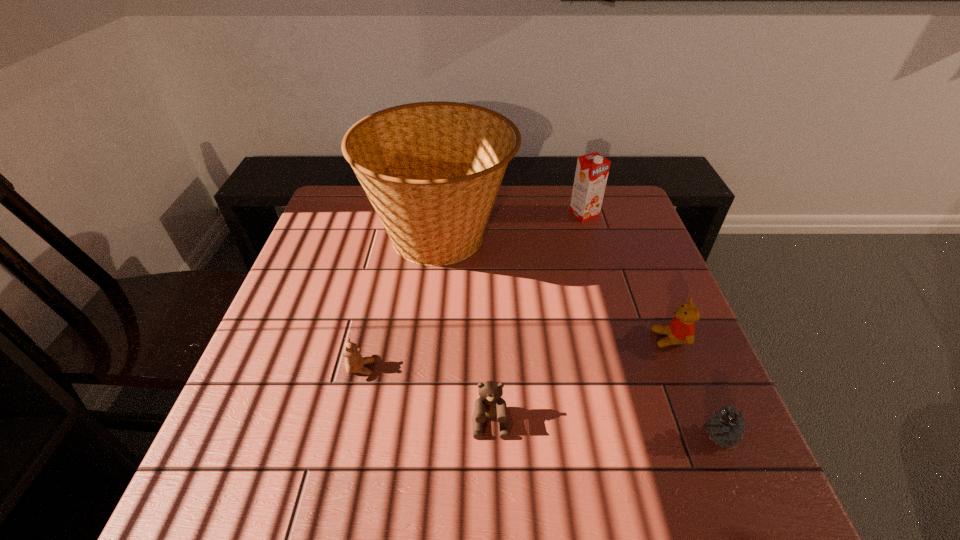
Where is `vacant area between the nearest teddy bear and the rightmost teddy bear`? The height and width of the screenshot is (540, 960). vacant area between the nearest teddy bear and the rightmost teddy bear is located at coordinates pos(580,381).

Locate which object ranks second in proximity to the pinecone. Please provide its 2D coordinates. Your answer should be formatted as a tuple, i.e. [(x, y)], where the tuple contains the x and y coordinates of a point satisfying the conditions above.

[(490, 405)]

Locate an element on the screen. The image size is (960, 540). object that is the second closest to the rightmost teddy bear is located at coordinates (432, 170).

You are a GUI agent. You are given a task and a screenshot of the screen. Output one action in this format:
    pyautogui.click(x=<x>, y=<y>)
    Task: Click on the teddy bear that stands as the second closest to the second teddy bear from right to left
    This screenshot has width=960, height=540.
    Given the screenshot: What is the action you would take?
    pyautogui.click(x=681, y=330)

Locate which teddy bear ranks third in proximity to the carton. Please provide its 2D coordinates. Your answer should be formatted as a tuple, i.e. [(x, y)], where the tuple contains the x and y coordinates of a point satisfying the conditions above.

[(354, 362)]

You are a GUI agent. You are given a task and a screenshot of the screen. Output one action in this format:
    pyautogui.click(x=<x>, y=<y>)
    Task: Click on the blank area in the image that satisfies the following two spatial constraints: 1. on the face of the pinecone; 2. on the left side of the second teddy bear from right to left
    Image resolution: width=960 pixels, height=540 pixels.
    Given the screenshot: What is the action you would take?
    pyautogui.click(x=491, y=435)

The width and height of the screenshot is (960, 540). What are the coordinates of `free space that satisfies the following two spatial constraints: 1. on the front-facing side of the rightmost teddy bear; 2. on the face of the second teddy bear from right to left` in the screenshot? It's located at (704, 423).

You are a GUI agent. You are given a task and a screenshot of the screen. Output one action in this format:
    pyautogui.click(x=<x>, y=<y>)
    Task: Click on the free location that satisfies the following two spatial constraints: 1. on the front-facing side of the rightmost teddy bear; 2. on the left side of the pinecone
    
    Given the screenshot: What is the action you would take?
    pyautogui.click(x=708, y=435)

At what (x,y) coordinates should I click in order to perform the action: click on free point that satisfies the following two spatial constraints: 1. on the face of the pinecone; 2. on the right side of the second teddy bear from left to right. Please return your answer as a coordinate pair (x, y). Looking at the image, I should click on (491, 435).